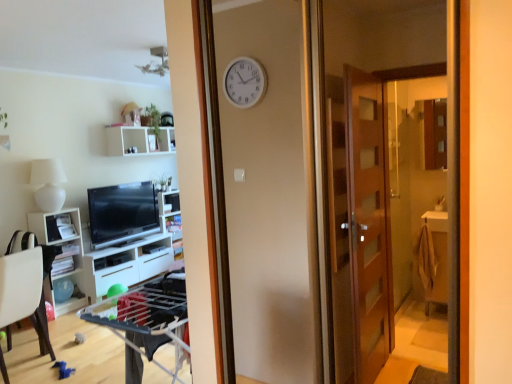
Question: Based on their sizes in the image, would you say white plastic chair at lower left is bigger or smaller than white glossy shelf at center, which is the 3th shelf in top-to-bottom order?

Choices:
 (A) small
 (B) big

Answer: (B)

Question: Looking at their shapes, would you say white plastic chair at lower left is wider or thinner than white glossy shelf at center, the first shelf in the bottom-to-top sequence?

Choices:
 (A) wide
 (B) thin

Answer: (A)

Question: Estimate the real-world distances between objects in this image. Which object is farther from the white matte lamp at left?

Choices:
 (A) white glossy cabinet at left, which is counted as the second cabinetry, starting from the back
 (B) white plastic chair at lower left
 (C) white glossy shelf at center, which is the 3th shelf in top-to-bottom order
 (D) white glossy cabinet at lower left, positioned as the first cabinetry in back-to-front order
 (E) white glossy shelf at center, which is the second shelf from bottom to top

Answer: (E)

Question: Which is nearer to the white glossy shelf at center, which is the second shelf from bottom to top?

Choices:
 (A) white plastic chair at lower left
 (B) white glossy shelf at center, which is the 3th shelf in top-to-bottom order
 (C) white glossy cabinet at left, which is counted as the second cabinetry, starting from the back
 (D) white matte shelf at upper center, marked as the third shelf in a bottom-to-top arrangement
 (E) white glossy cabinet at lower left, the second cabinetry when ordered from front to back

Answer: (B)